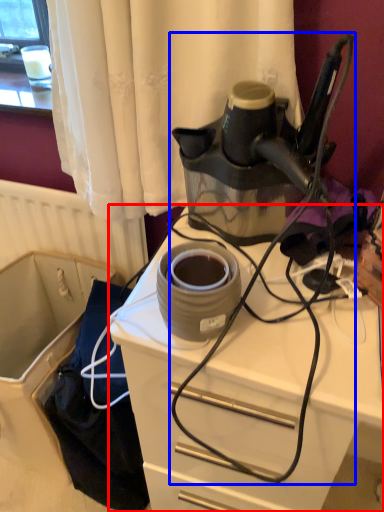
Question: Which object appears farthest to the camera in this image, desk (highlighted by a red box) or wire (highlighted by a blue box)?

Choices:
 (A) desk
 (B) wire

Answer: (A)